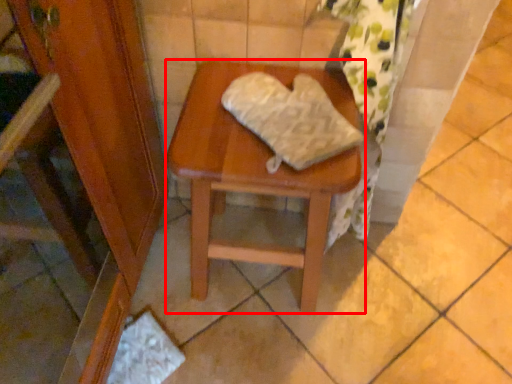
Question: From the image's perspective, where is stool (annotated by the red box) located relative to material?

Choices:
 (A) above
 (B) below

Answer: (B)